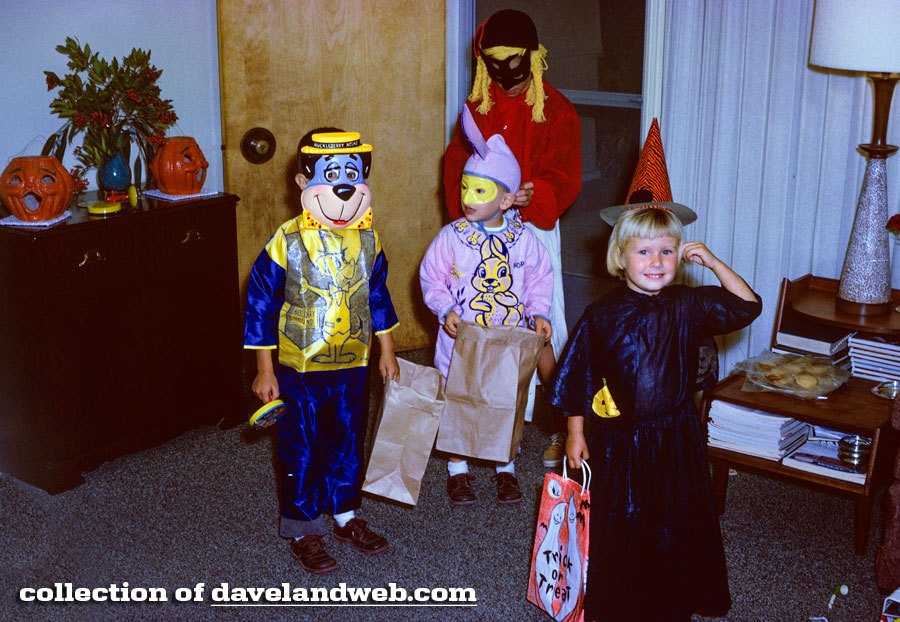
Locate an element on the screen. The image size is (900, 622). lamp is located at coordinates (869, 170).